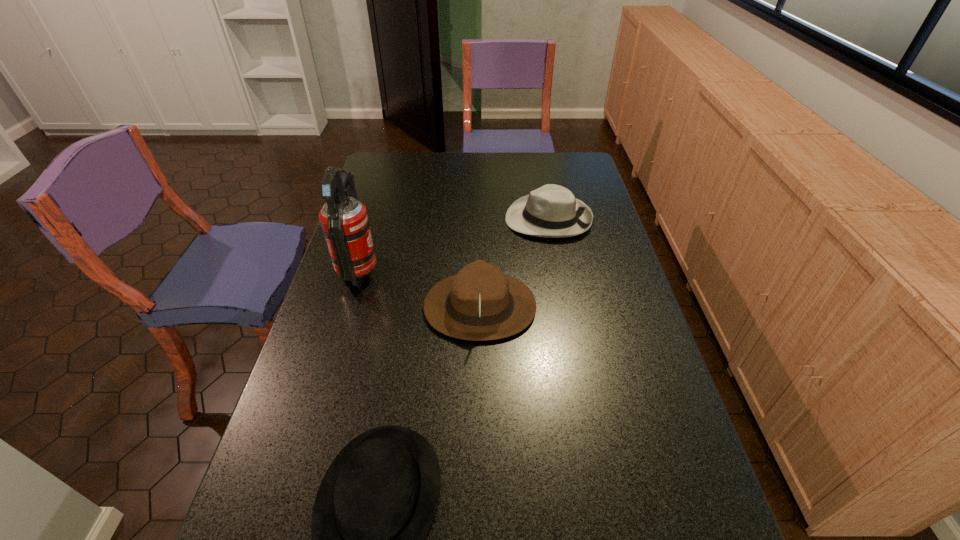
I want to click on the tallest object, so click(345, 225).

In order to click on the second tallest object in this screenshot , I will do [480, 303].

Find the location of a particular element. the second farthest fedora is located at coordinates (480, 303).

I want to click on the farthest object, so click(x=552, y=211).

The width and height of the screenshot is (960, 540). I want to click on the third tallest object, so click(x=552, y=211).

You are a GUI agent. You are given a task and a screenshot of the screen. Output one action in this format:
    pyautogui.click(x=<x>, y=<y>)
    Task: Click on the vacant space situated 0.130m on the front label side of the fire extinguisher
    Image resolution: width=960 pixels, height=540 pixels.
    Given the screenshot: What is the action you would take?
    pyautogui.click(x=421, y=272)

At what (x,y) coordinates should I click in order to perform the action: click on free space located on the feather side of the tallest fedora. Please return your answer as a coordinate pair (x, y). The height and width of the screenshot is (540, 960). Looking at the image, I should click on point(557,307).

Identify the location of free location located on the front-facing side of the farthest fedora. This screenshot has height=540, width=960. (436, 219).

Locate an element on the screen. vacant space located 0.100m on the front-facing side of the farthest fedora is located at coordinates (477, 219).

Locate an element on the screen. Image resolution: width=960 pixels, height=540 pixels. vacant space located on the front-facing side of the farthest fedora is located at coordinates (433, 219).